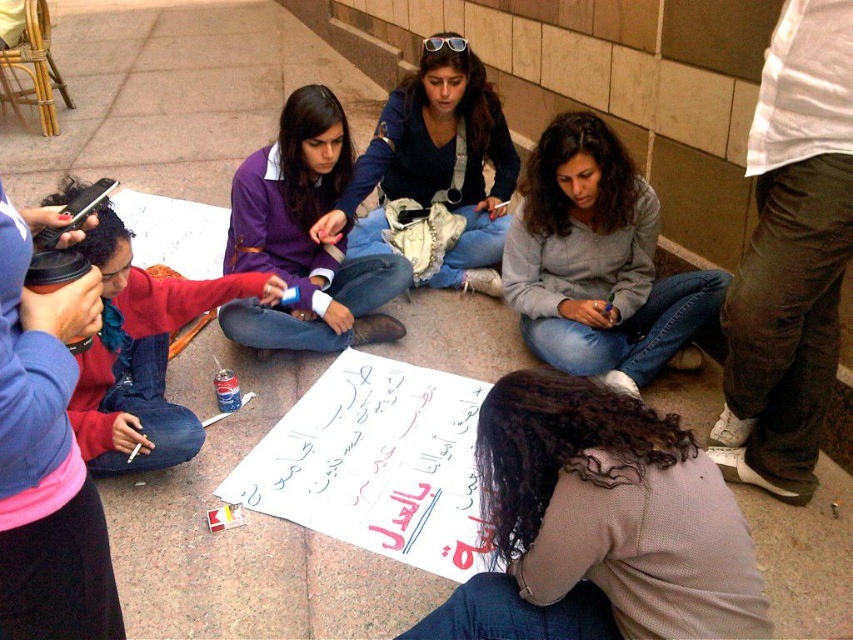
Based on the scene description, where is the light brown sweater at lower center located in terms of its 2D coordinates?

The light brown sweater at lower center is located at the 2D coordinates of point (599, 524).

You are an observer standing in front of the tiled wall. You notice two items in the scene, the blue denim jeans at center and the matte red sweater at lower left. Which item is taller?

The blue denim jeans at center is taller than the matte red sweater at lower left.